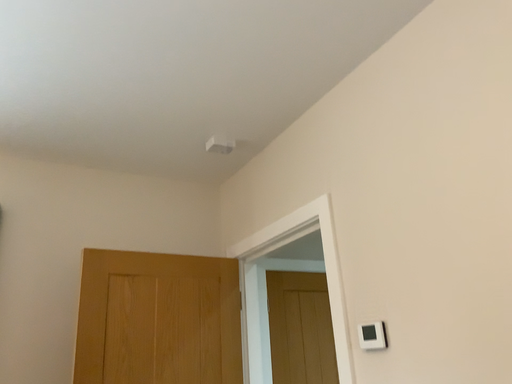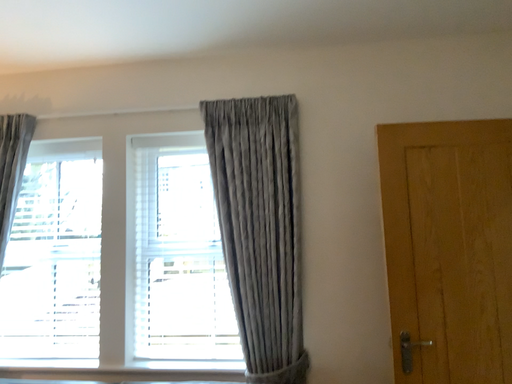
Question: Which way did the camera rotate in the video?

Choices:
 (A) rotated upward
 (B) rotated downward

Answer: (B)